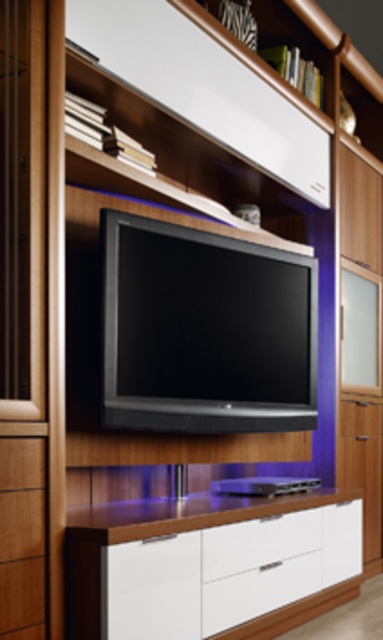
Is white glossy drawer at lower center in front of wooden drawer at lower left?

No, white glossy drawer at lower center is behind wooden drawer at lower left.

Can you confirm if white glossy drawer at lower center is wider than wooden drawer at lower left?

Yes, white glossy drawer at lower center is wider than wooden drawer at lower left.

Who is more distant from viewer, (191, 573) or (42, 588)?

The point (191, 573) is behind.

What are the coordinates of `white glossy drawer at lower center` in the screenshot? It's located at (227, 572).

Does black glossy flat screen tv at center lie behind white glossy drawer at lower center?

Yes, it is behind white glossy drawer at lower center.

Can you confirm if black glossy flat screen tv at center is wider than white glossy drawer at lower center?

Incorrect, black glossy flat screen tv at center's width does not surpass white glossy drawer at lower center's.

Between point (260, 337) and point (276, 566), which one is positioned in front?

Point (276, 566)

Locate an element on the screen. black glossy flat screen tv at center is located at coordinates (204, 330).

Who is positioned more to the right, black glossy flat screen tv at center or wooden drawer at lower left?

From the viewer's perspective, black glossy flat screen tv at center appears more on the right side.

Is point (176, 385) positioned before point (19, 481)?

No, it is behind (19, 481).

Is point (165, 328) positioned behind point (37, 536)?

Yes, it is.

The image size is (383, 640). I want to click on black glossy flat screen tv at center, so 204,330.